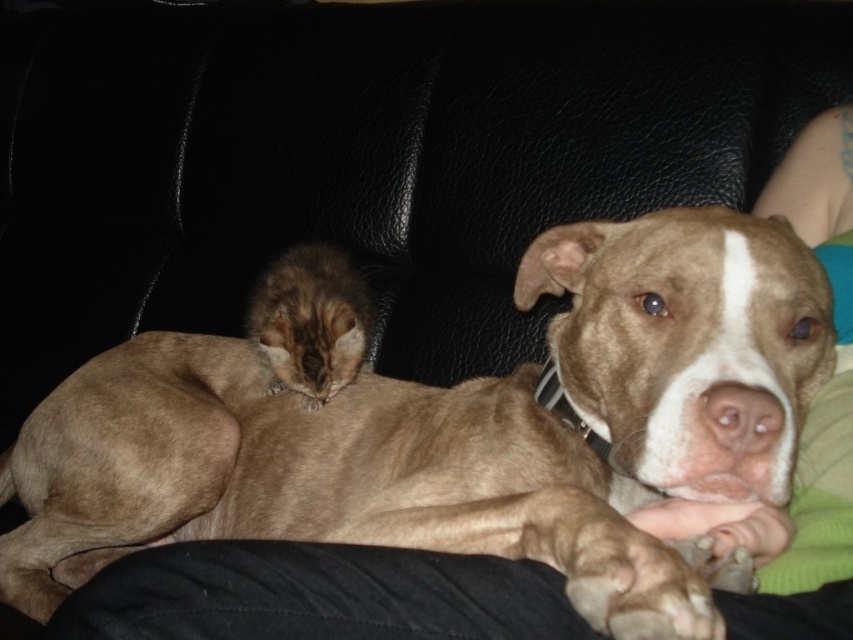
Is brown fur dog at center taller than fuzzy brown cat at center?

Indeed, brown fur dog at center has a greater height compared to fuzzy brown cat at center.

Who is positioned more to the left, brown fur dog at center or fuzzy brown cat at center?

Positioned to the left is fuzzy brown cat at center.

Who is more distant from viewer, (740, 401) or (287, 300)?

The point (287, 300) is more distant.

This screenshot has height=640, width=853. What are the coordinates of `brown fur dog at center` in the screenshot? It's located at (460, 429).